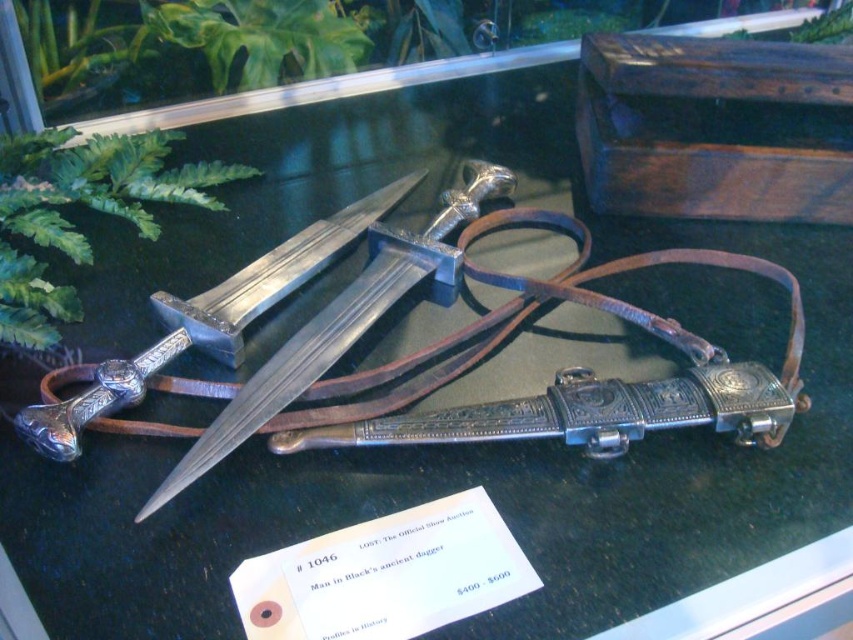
What do you see at coordinates (341, 323) in the screenshot? I see `polished silver sword at center` at bounding box center [341, 323].

Is polished silver sword at center thinner than polished silver dagger at center?

No, polished silver sword at center is not thinner than polished silver dagger at center.

Where is `polished silver sword at center`? polished silver sword at center is located at coordinates (341, 323).

The height and width of the screenshot is (640, 853). I want to click on polished silver sword at center, so pyautogui.click(x=341, y=323).